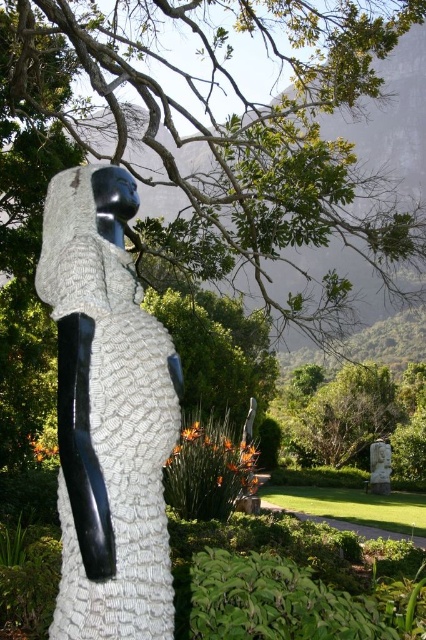
Does textured white statue at center appear under white marble statue at lower right?

No.

How far apart are textured white statue at center and white marble statue at lower right?

textured white statue at center and white marble statue at lower right are 10.68 meters apart.

Which is behind, point (60, 476) or point (374, 484)?

The point (374, 484) is more distant.

At what (x,y) coordinates should I click in order to perform the action: click on textured white statue at center. Please return your answer as a coordinate pair (x, y). The width and height of the screenshot is (426, 640). Looking at the image, I should click on (109, 413).

In order to click on green leafy tree at upper center in this screenshot , I will do `click(238, 124)`.

Does point (218, 68) come closer to viewer compared to point (68, 632)?

No.

Locate an element on the screen. The height and width of the screenshot is (640, 426). green leafy tree at upper center is located at coordinates pyautogui.click(x=238, y=124).

Describe the element at coordinates (238, 124) in the screenshot. I see `green leafy tree at upper center` at that location.

Does green leafy tree at upper center appear on the right side of white marble statue at lower right?

In fact, green leafy tree at upper center is to the left of white marble statue at lower right.

Does point (227, 211) come in front of point (379, 476)?

Yes, point (227, 211) is closer to viewer.

Locate an element on the screen. green leafy tree at upper center is located at coordinates (238, 124).